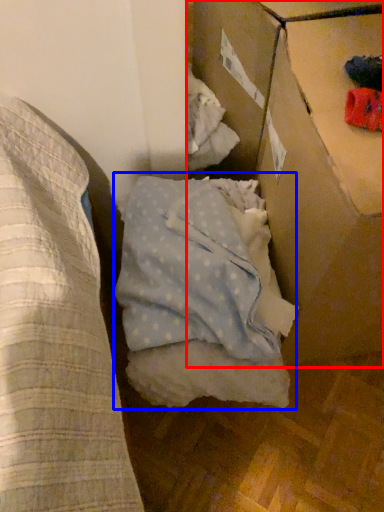
Question: Which object appears closest to the camera in this image, cardboard box (highlighted by a red box) or sheet (highlighted by a blue box)?

Choices:
 (A) cardboard box
 (B) sheet

Answer: (A)